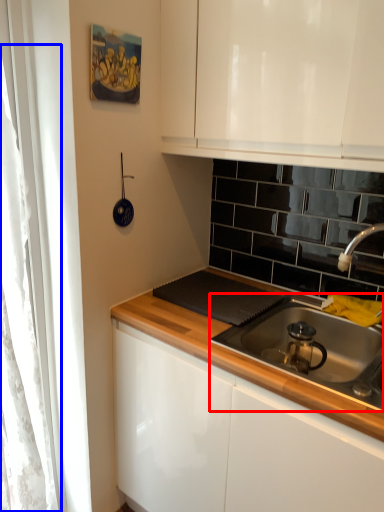
Question: Among these objects, which one is nearest to the camera, gas stove (highlighted by a red box) or curtain (highlighted by a blue box)?

Choices:
 (A) gas stove
 (B) curtain

Answer: (A)